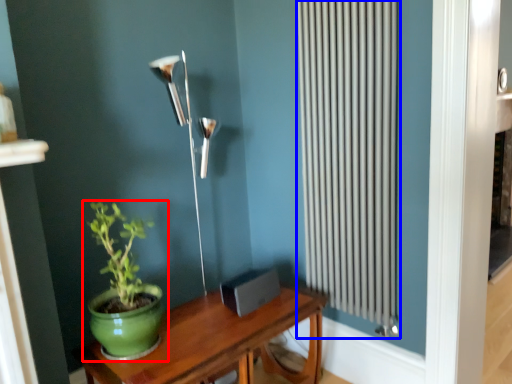
Question: Among these objects, which one is farthest to the camera, houseplant (highlighted by a red box) or radiator (highlighted by a blue box)?

Choices:
 (A) houseplant
 (B) radiator

Answer: (B)